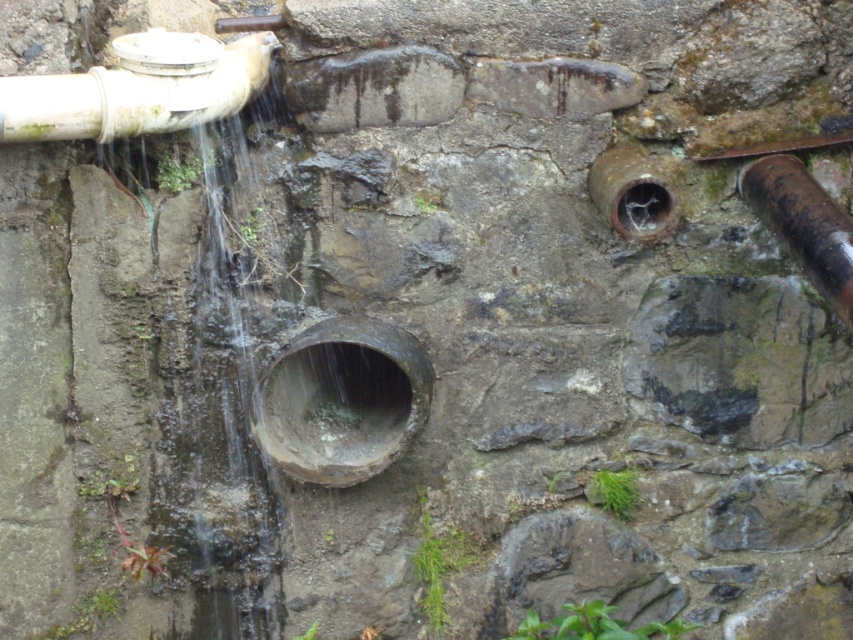
You are a maintenance worker inspecting the wall. You need to locate the white matte water pipe at upper left. According to the coordinates provided, where exactly should you look on the wall?

The white matte water pipe at upper left is located at the coordinates point (138, 88).

You are a maintenance worker needing to replace a pipe. You have a tool that can reach up to 12 inches. You see the rusty metal pipe at center and the white matte water pipe at upper left. Can your tool reach both pipes at the same time if they are 11.96 inches apart?

The distance between the rusty metal pipe at center and the white matte water pipe at upper left is 11.96 inches. Since your tool can reach up to 12 inches, it can reach both pipes at the same time as the distance is within the tool reach range.

You are a plumber inspecting the wall and need to replace the narrower rusty metal pipe. Which one should you choose between the rusty metal pipe at center and the rusty metal pipe at right?

The rusty metal pipe at right is narrower than the rusty metal pipe at center, so you should choose the rusty metal pipe at right to replace since it is narrower.